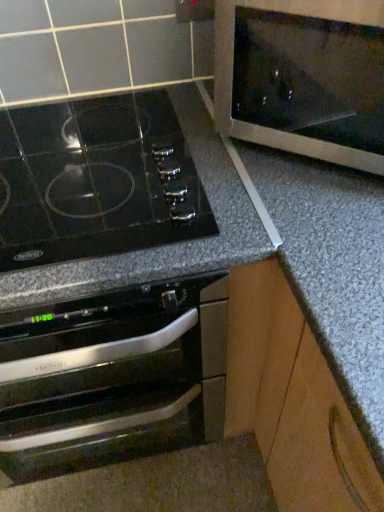
Locate an element on the screen. black glossy microwave at upper right is located at coordinates (303, 77).

Describe the element at coordinates (303, 77) in the screenshot. The image size is (384, 512). I see `black glossy microwave at upper right` at that location.

Find the location of a particular element. This screenshot has width=384, height=512. black glossy microwave at upper right is located at coordinates (303, 77).